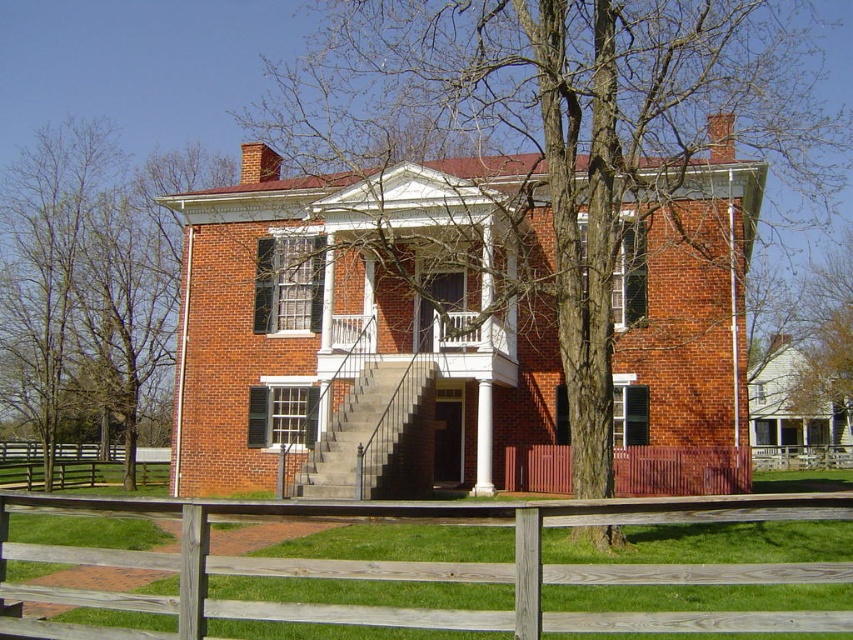
You are a landscape architect designing a garden for the property. You need to place a 3m wide flower bed between the wooden picket fence at lower center and the bare wood tree at right. Is there enough space?

The wooden picket fence at lower center is narrower than the bare wood tree at right. Therefore, the flower bed of 3m width may not fit if the distance between them is less than 3m. However, the description only states the fence is narrower, not the exact distance. Without knowing the actual distance between them, it is impossible to determine if the flower bed will fit.

You are a gardener planning to plant a new tree that requires a minimum of 40 feet of space between it and any existing structures. You see the bare wood tree at center and the rustic wooden fence at lower center. Can you plant the new tree between them without violating the spacing requirement?

The distance between the bare wood tree at center and the rustic wooden fence at lower center is 40.64 feet, which meets the minimum requirement of 40 feet. Therefore, you can plant the new tree between them as the existing spacing allows for the required distance.

You are a visitor approaching the house and notice the brown bark tree at center and the brown wooden fence at lower left. Which object would block your view first if you were to walk straight towards the house from the front?

The brown bark tree at center would block your view first because it is taller than the brown wooden fence at lower left.